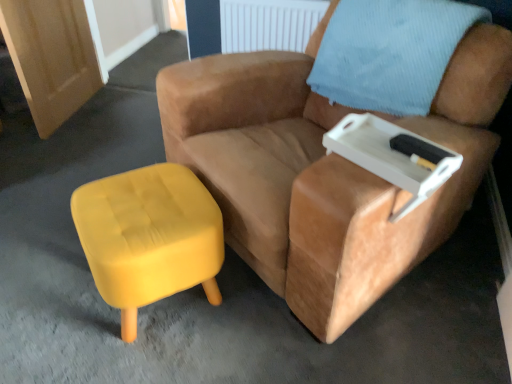
The image size is (512, 384). I want to click on vacant point above yellow fabric stool at lower left (from a real-world perspective), so click(142, 207).